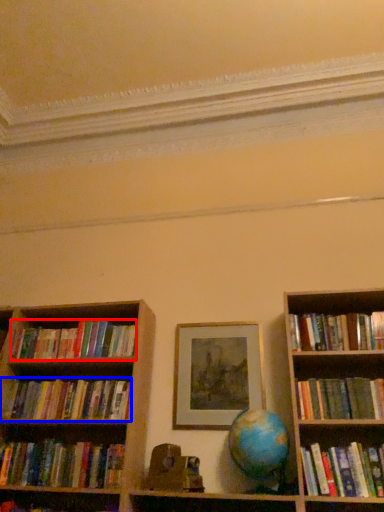
Question: Among these objects, which one is nearest to the camera, book (highlighted by a red box) or book (highlighted by a blue box)?

Choices:
 (A) book
 (B) book

Answer: (B)